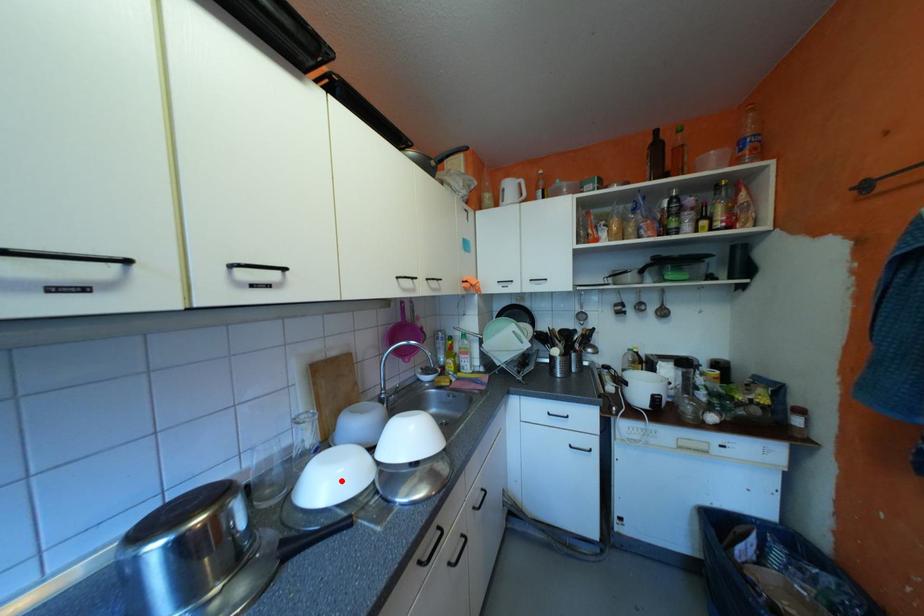
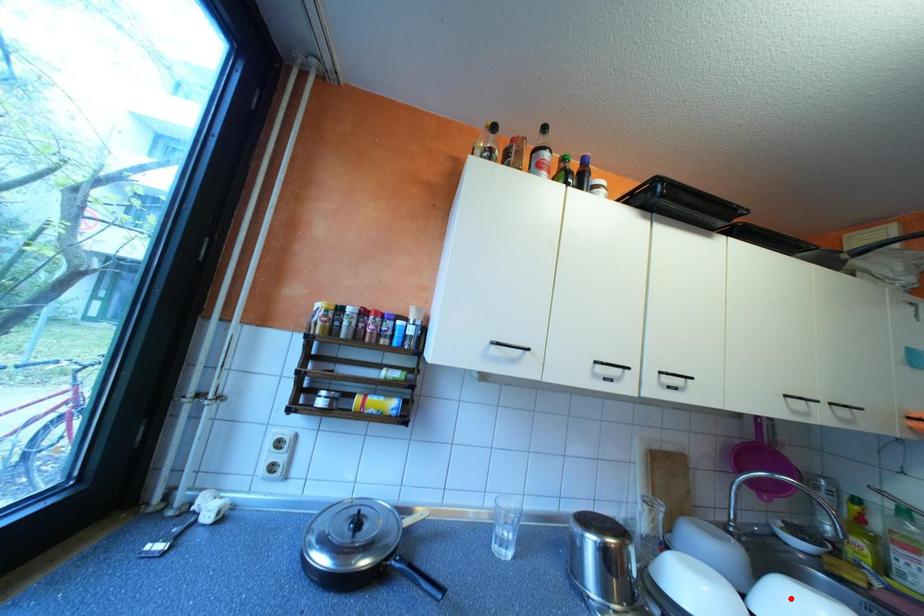
I am providing you with two images of the same scene from different viewpoints. A red point is marked on the first image and another point is marked on the second image. Is the red point in image1 aligned with the point shown in image2?

No